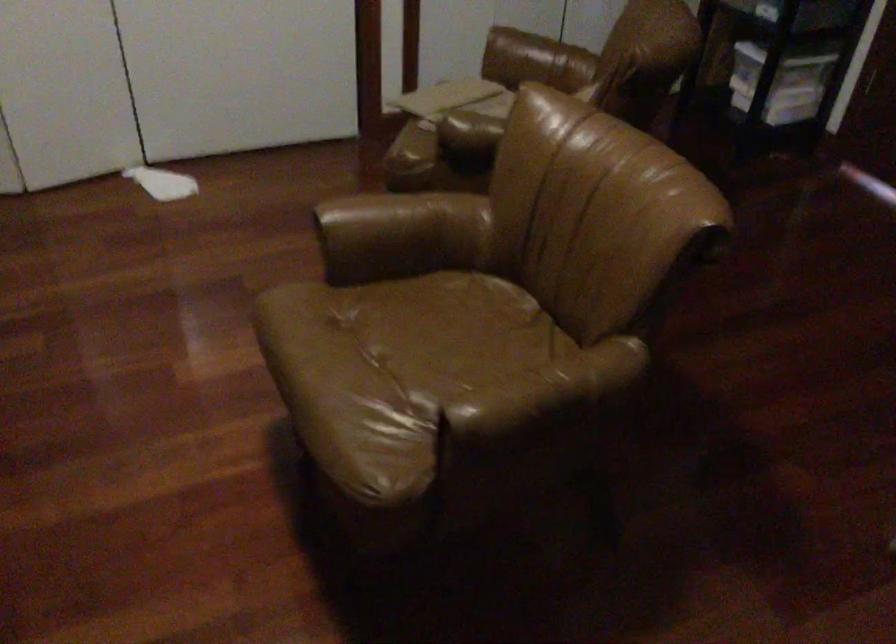
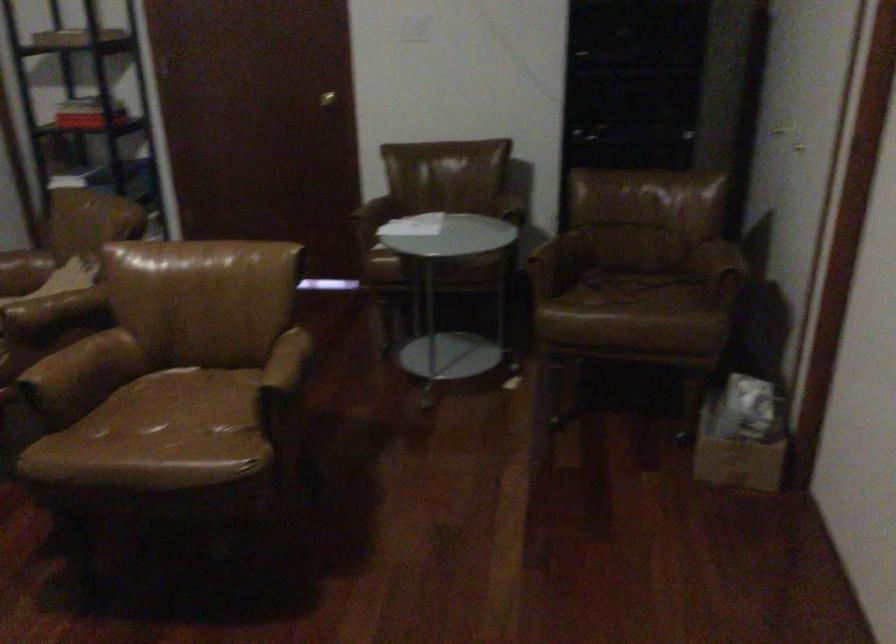
Locate, in the second image, the point that corresponds to point (433, 353) in the first image.

(178, 413)